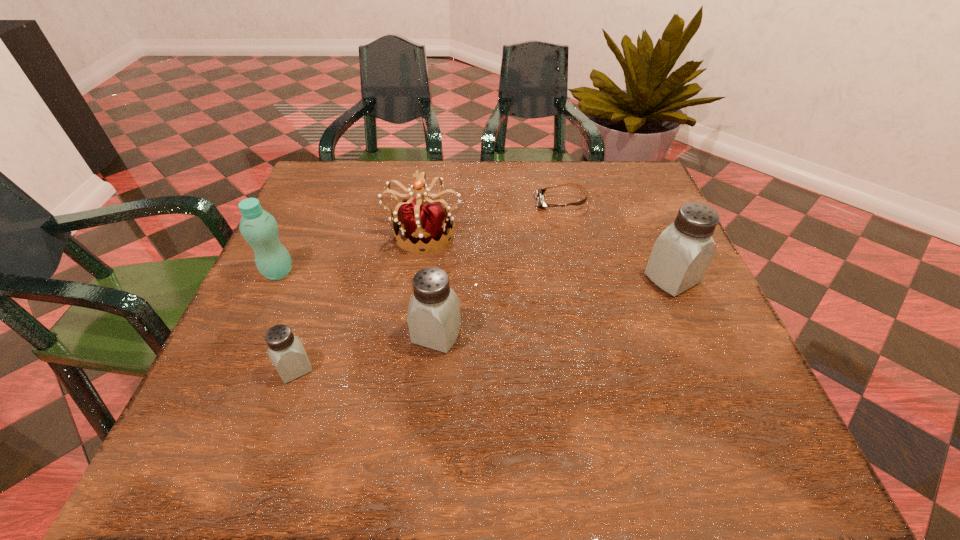
If equal spacing is the goal by inserting an additional saltshaker among them, please point out a vacant space for this new saltshaker. Please provide its 2D coordinates. Your answer should be formatted as a tuple, i.e. [(x, y)], where the tuple contains the x and y coordinates of a point satisfying the conditions above.

[(562, 305)]